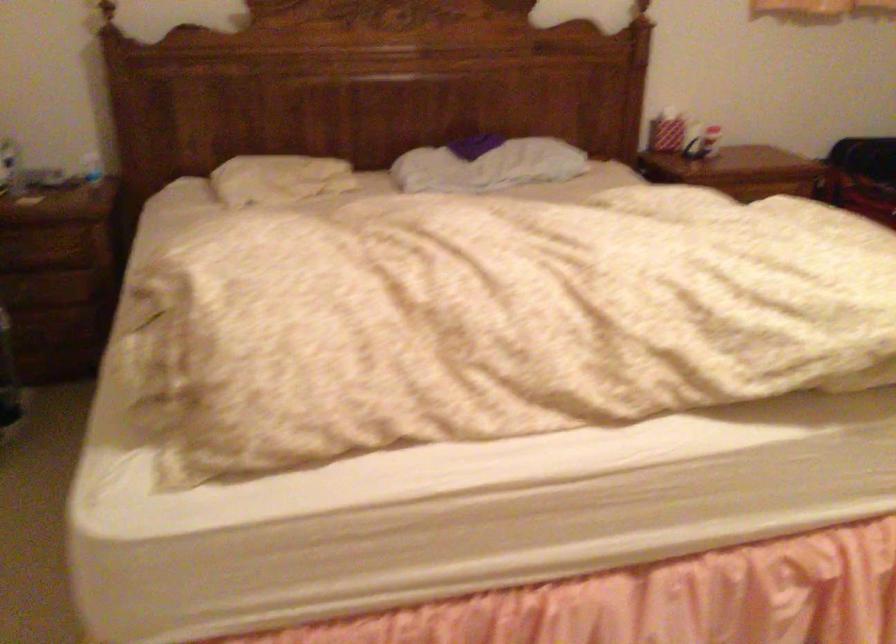
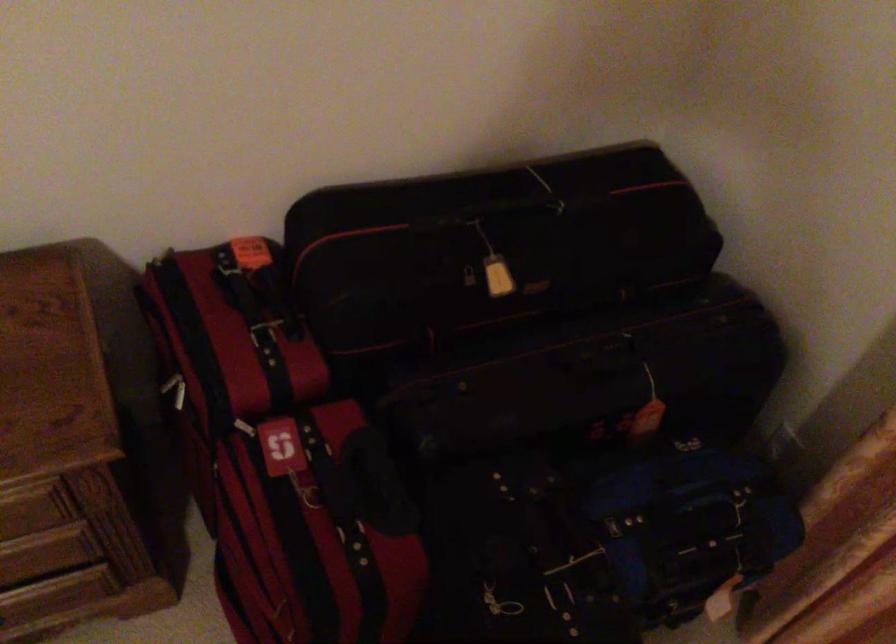
The images are taken continuously from a first-person perspective. In which direction are you moving?

The cameraman moved toward right, forward.